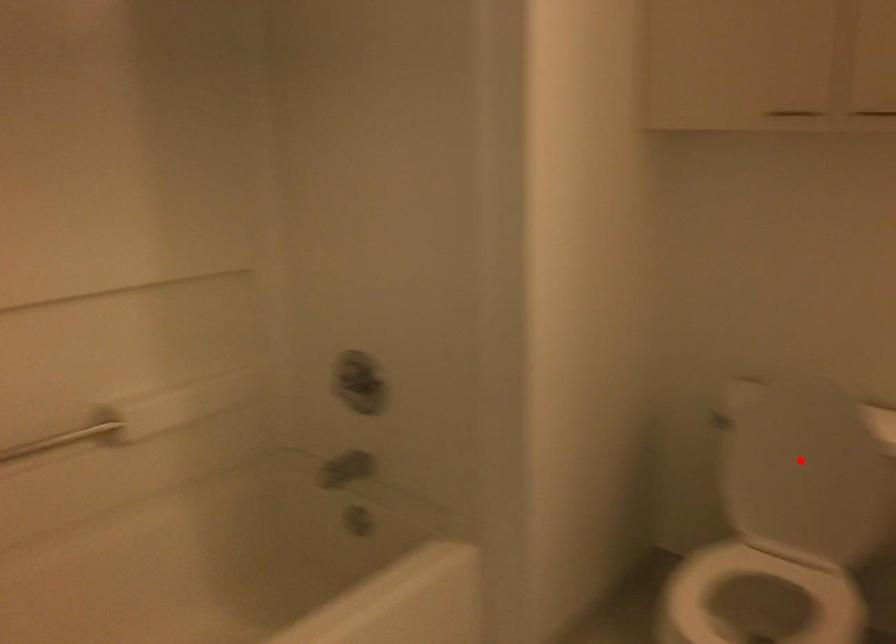
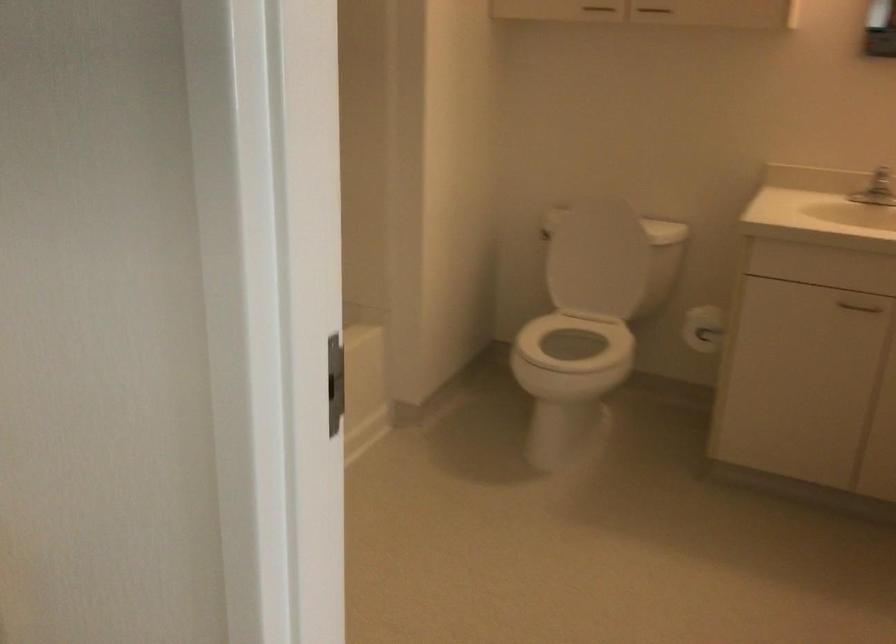
Question: I am providing you with two images of the same scene from different viewpoints. In image1, a red point is highlighted. Considering the same 3D point in image2, which of the following is correct?

Choices:
 (A) It is closer
 (B) It is farther

Answer: (B)